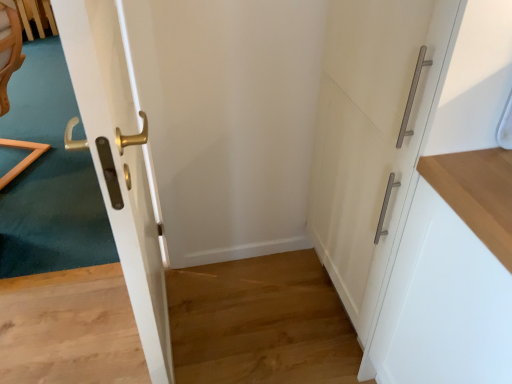
This screenshot has width=512, height=384. Find the location of `free point to the left of glossy white door at left, which is the second door from right to left`. free point to the left of glossy white door at left, which is the second door from right to left is located at coordinates (81, 331).